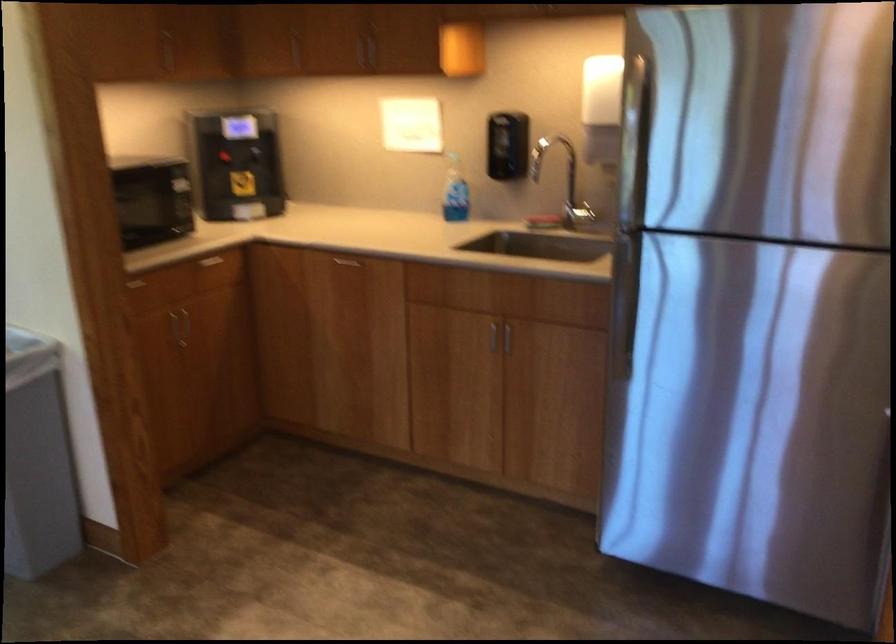
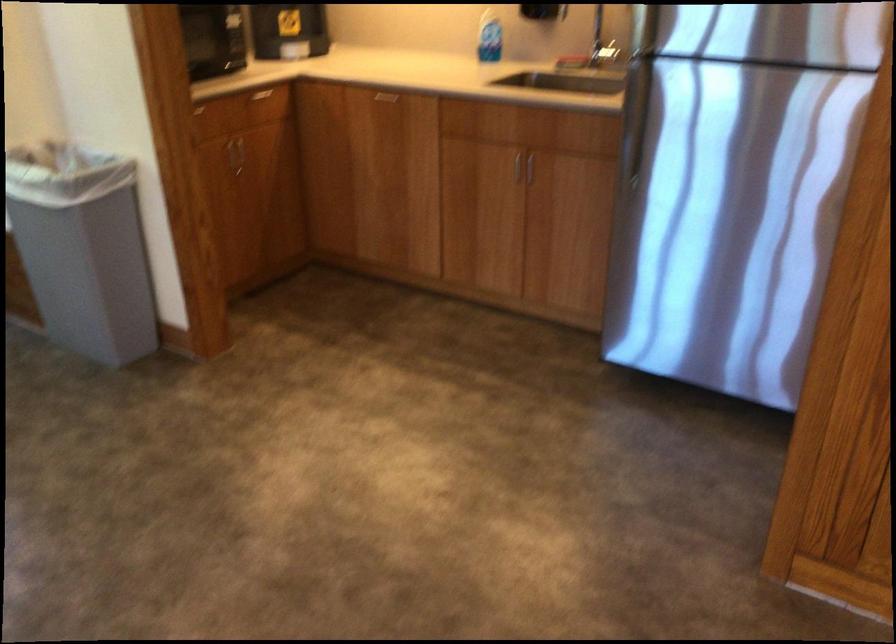
Where in the second image is the point corresponding to [183,321] from the first image?

(239, 151)